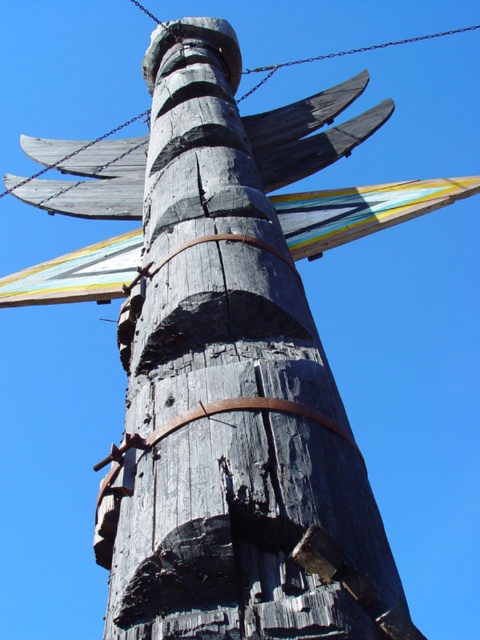
Is charcoal wood totem pole at center shorter than metallic chain at upper center?

Yes, charcoal wood totem pole at center is shorter than metallic chain at upper center.

Is charcoal wood totem pole at center wider than metallic chain at upper center?

In fact, charcoal wood totem pole at center might be narrower than metallic chain at upper center.

The width and height of the screenshot is (480, 640). What do you see at coordinates (235, 384) in the screenshot? I see `charcoal wood totem pole at center` at bounding box center [235, 384].

This screenshot has height=640, width=480. In order to click on charcoal wood totem pole at center in this screenshot , I will do [235, 384].